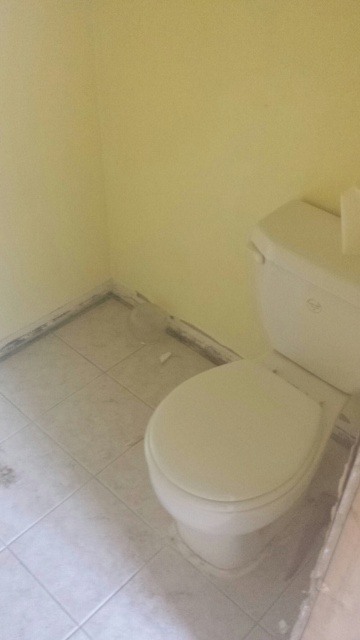
The height and width of the screenshot is (640, 360). I want to click on white glossy toilet at right, so click(263, 396).

Which is behind, point (268, 467) or point (293, 456)?

Positioned behind is point (293, 456).

Is point (267, 388) farther from camera compared to point (227, 424)?

Yes, it is.

Find the location of a particular element. Image resolution: width=360 pixels, height=640 pixels. white glossy toilet at right is located at coordinates (263, 396).